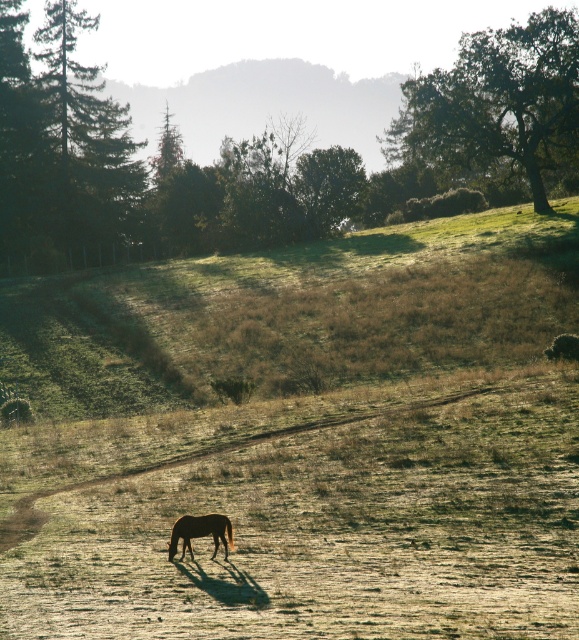
You are standing at the point with coordinates point (184, 529) and want to walk towards the point (448, 81). Which direction should you move to get closer to your destination?

Since point (448, 81) is further to the camera than point (184, 529), you should move forward towards the direction of the destination point.

You are a photographer trying to capture a photo of the brown glossy horse at center without the green leafy tree at upper right blocking the view. Is there a way to adjust your position so that the tree does not appear in the shot?

The green leafy tree at upper right is positioned over the brown glossy horse at center, so moving to the left or right might allow you to frame the horse without the tree obstructing the view.

You are standing in the middle of the grassy field and want to walk towards the green leafy tree at upper right. Which direction should you head?

The green leafy tree at upper right is located at point 0.163 on the x axis and 0.860 on the y axis. Since the x coordinate is less than 0.5, it is to the left side of the image. The y coordinate is closer to 1, meaning it is towards the top of the image. Therefore, you should head towards the upper left direction to reach the green leafy tree at upper right.